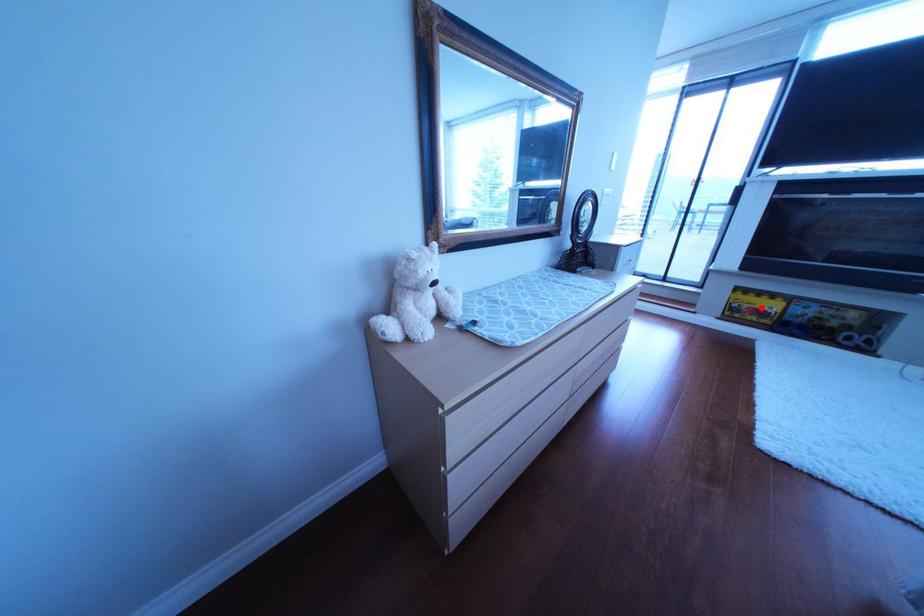
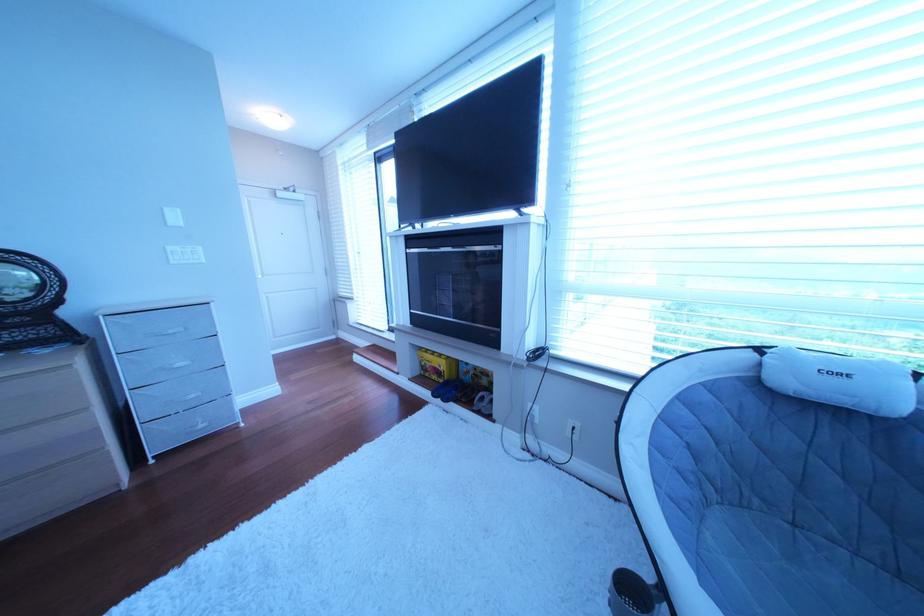
Question: I am providing you with two images of the same scene from different viewpoints. Image1 has a red point marked. In image2, the corresponding 3D location appears at what relative position? Reply with the corresponding letter.

Choices:
 (A) Closer
 (B) Farther

Answer: (B)